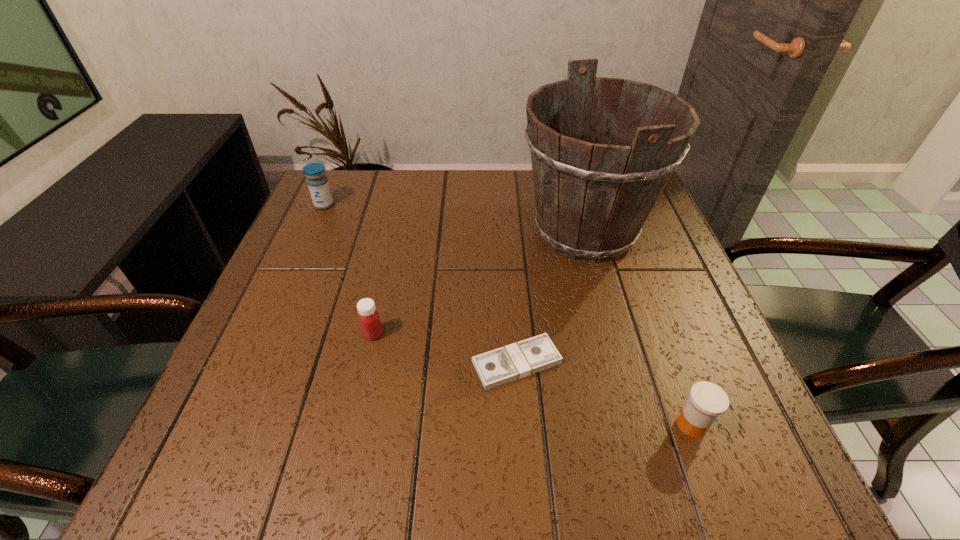
Identify the location of free area in between the shortest object and the nearest medicine. Image resolution: width=960 pixels, height=540 pixels. (604, 394).

Locate an element on the screen. free area in between the tallest object and the shortest object is located at coordinates (551, 297).

This screenshot has height=540, width=960. I want to click on empty space between the second object from left to right and the nearest object, so click(533, 380).

This screenshot has height=540, width=960. Find the location of `free spot between the shortest object and the nearest medicine`. free spot between the shortest object and the nearest medicine is located at coordinates (604, 394).

The image size is (960, 540). Find the location of `free space between the shortest object and the nearest medicine`. free space between the shortest object and the nearest medicine is located at coordinates (604, 394).

Image resolution: width=960 pixels, height=540 pixels. What are the coordinates of `empty space that is in between the shortest object and the nearest medicine` in the screenshot? It's located at (604, 394).

Locate an element on the screen. This screenshot has height=540, width=960. vacant point located between the bucket and the leftmost medicine is located at coordinates (455, 218).

This screenshot has width=960, height=540. Identify the location of vacant region between the dollar and the tallest object. (551, 297).

Locate an element on the screen. The width and height of the screenshot is (960, 540). vacant space in between the fourth object from right to left and the nearest medicine is located at coordinates (533, 380).

Where is `object that stands as the third closest to the second medicine from right to left`? The image size is (960, 540). object that stands as the third closest to the second medicine from right to left is located at coordinates (318, 184).